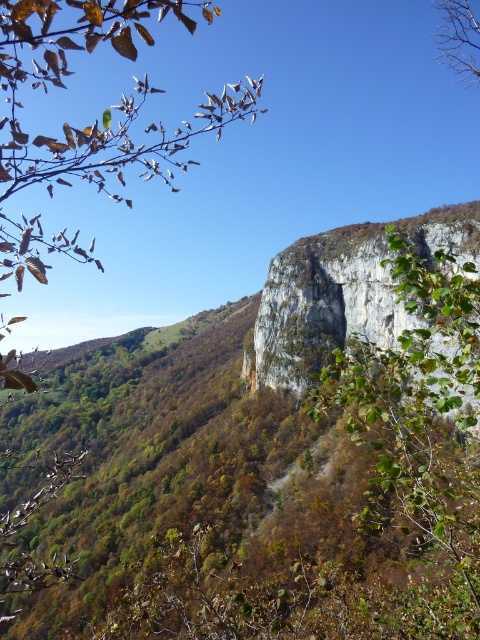
You are an artist sketching the landscape and want to compare the visual impact of the green leafy branch at upper left and the gray rough rock face at upper center. Which object occupies a wider area in the composition?

The green leafy branch at upper left occupies a wider area in the composition than the gray rough rock face at upper center because its width surpasses that of the rock face.